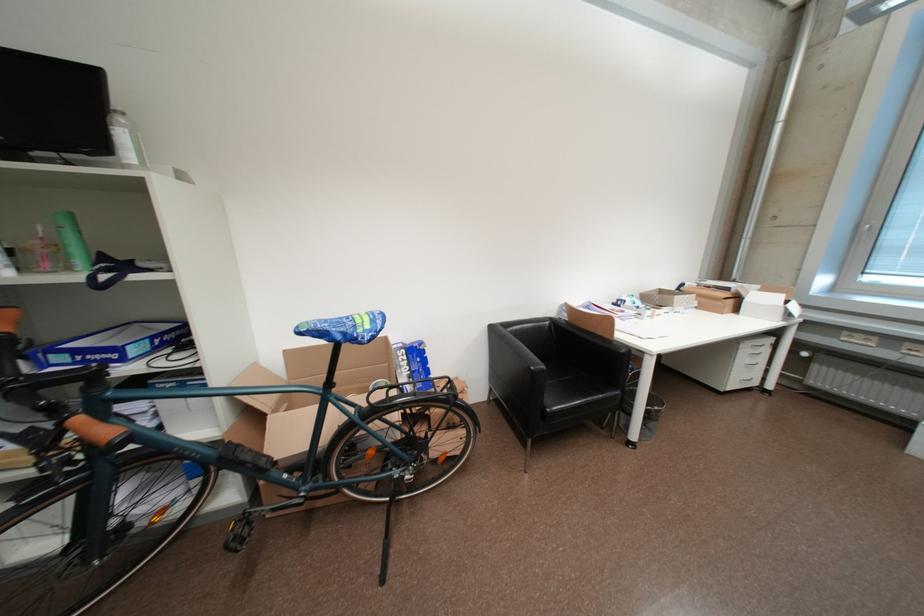
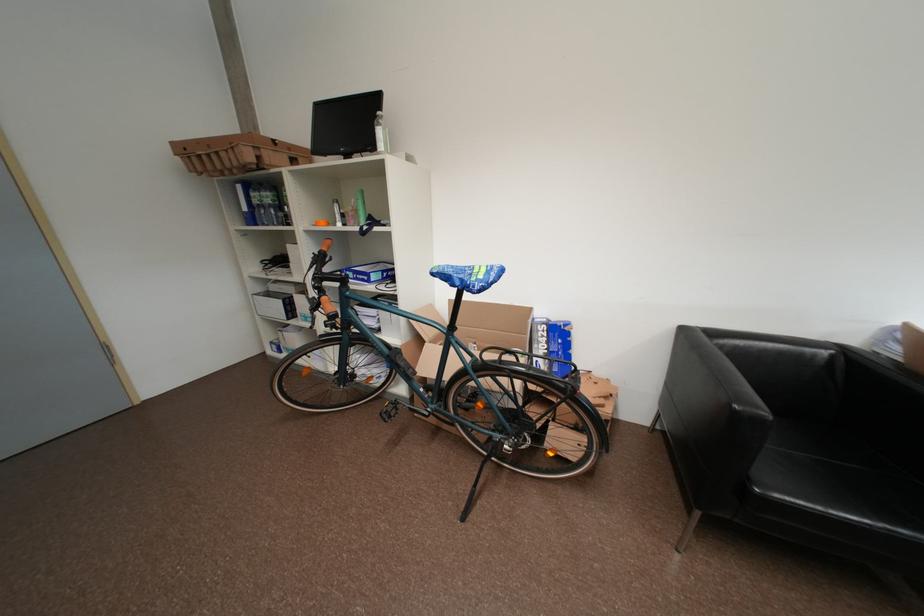
Find the pixel in the second image that matches (66,248) in the first image.

(363, 213)